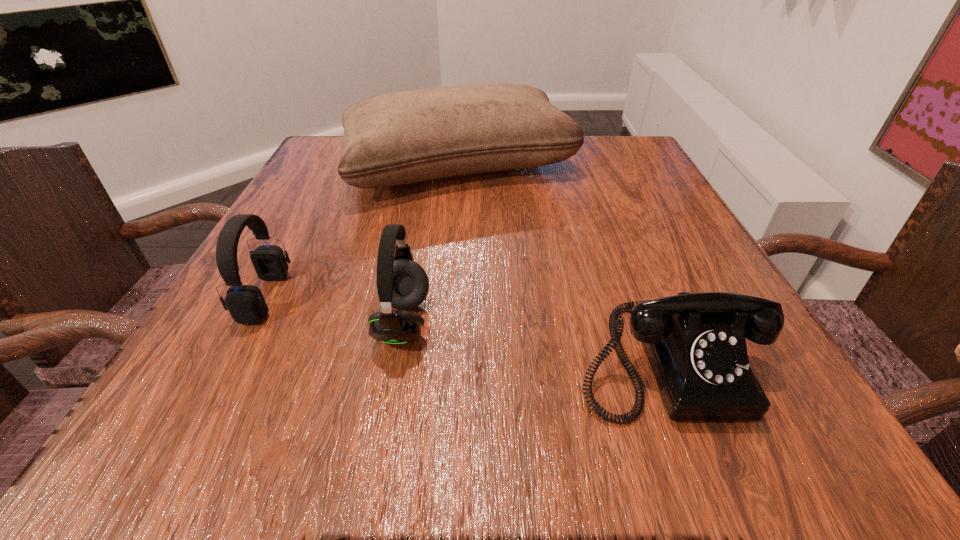
Identify the location of the farthest object. (412, 136).

This screenshot has width=960, height=540. Identify the location of the right headset. (403, 284).

At what (x,y) coordinates should I click in order to perform the action: click on the left headset. Please return your answer as a coordinate pair (x, y). This screenshot has height=540, width=960. Looking at the image, I should click on (245, 303).

I want to click on telephone, so click(696, 345).

In order to click on vacant space located 0.310m on the ear cups of the right headset in this screenshot , I will do `click(642, 322)`.

This screenshot has width=960, height=540. Find the location of `free region located 0.390m on the headband of the left headset`. free region located 0.390m on the headband of the left headset is located at coordinates (537, 297).

Identify the location of object present at the far edge. (412, 136).

The width and height of the screenshot is (960, 540). In order to click on object at the near edge in this screenshot , I will do [x=696, y=345].

Find the location of `cushion at the left edge`. cushion at the left edge is located at coordinates (412, 136).

The image size is (960, 540). Identify the location of headset that is at the left edge. (245, 303).